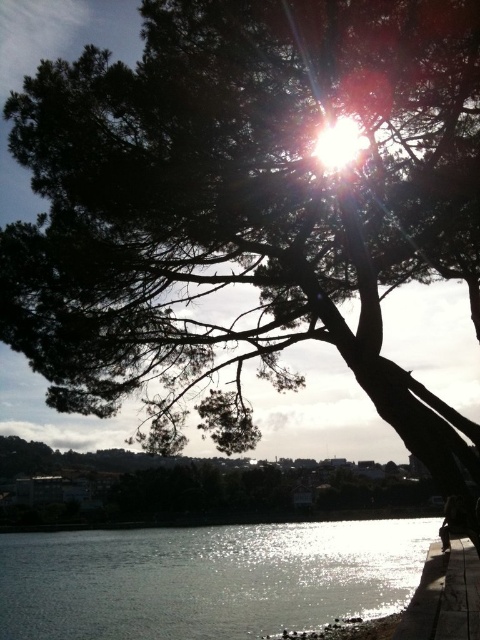
Which is more to the right, glistening silver water at lower left or smooth concrete ledge at lower right?

From the viewer's perspective, smooth concrete ledge at lower right appears more on the right side.

Can you confirm if glistening silver water at lower left is positioned to the left of smooth concrete ledge at lower right?

Indeed, glistening silver water at lower left is positioned on the left side of smooth concrete ledge at lower right.

Identify the location of glistening silver water at lower left. (206, 579).